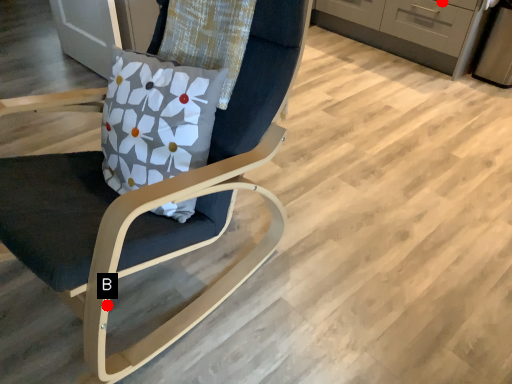
Question: Two points are circled on the image, labeled by A and B beside each circle. Which point is closer to the camera?

Choices:
 (A) A is closer
 (B) B is closer

Answer: (B)